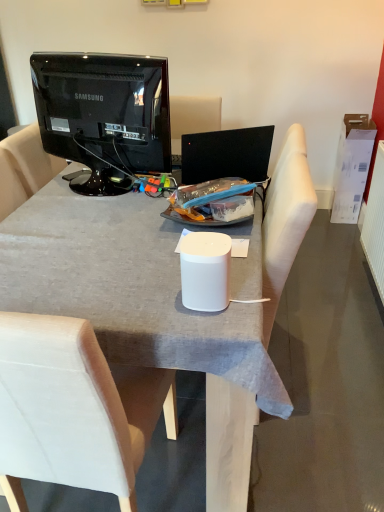
Find the location of a particular element. The image size is (384, 512). vacant area on the back side of white matte smart speaker at center is located at coordinates (178, 264).